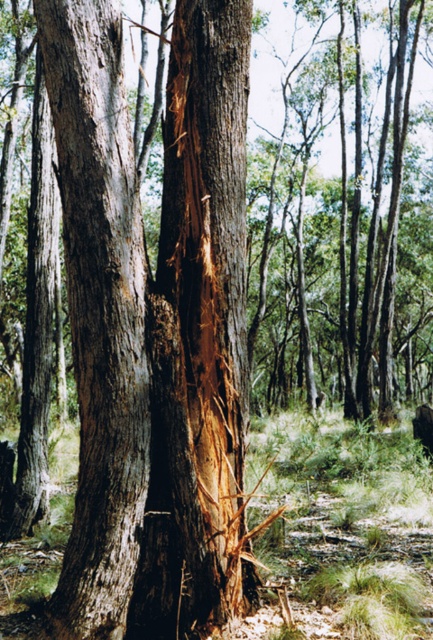
Question: Among these points, which one is farthest from the camera?

Choices:
 (A) (232, 237)
 (B) (78, 456)

Answer: (B)

Question: Can you confirm if brown rough bark tree trunk at center is positioned above smooth brown bark at center?

Choices:
 (A) yes
 (B) no

Answer: (A)

Question: Can you confirm if brown rough bark tree trunk at center is wider than smooth brown bark at center?

Choices:
 (A) yes
 (B) no

Answer: (A)

Question: Where is brown rough bark tree trunk at center located in relation to smooth brown bark at center in the image?

Choices:
 (A) left
 (B) right

Answer: (B)

Question: Which object is farther from the camera taking this photo?

Choices:
 (A) brown rough bark tree trunk at center
 (B) smooth brown bark at center

Answer: (A)